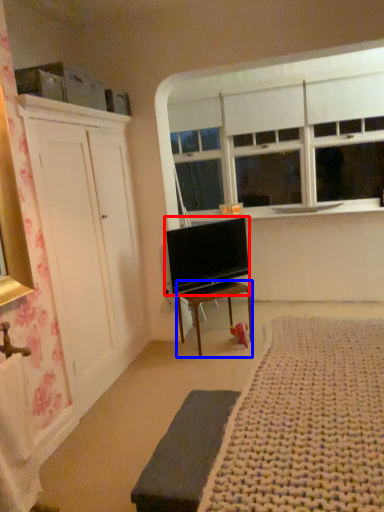
Question: Among these objects, which one is farthest to the camera, television (highlighted by a red box) or desk (highlighted by a blue box)?

Choices:
 (A) television
 (B) desk

Answer: (B)